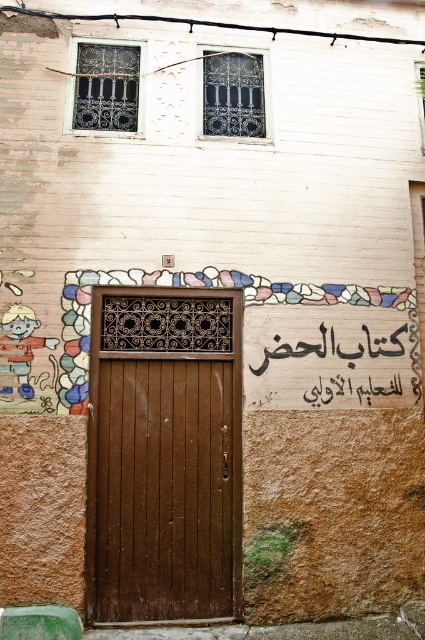
You are standing in front of a building and see the brown wooden door at center. A point marked at coordinates (164, 456) is labeled. Based on the scene, where is this point located?

The point at (164, 456) marks the brown wooden door at center.

You are a painter who needs to cover the entire surface of the brown wooden door at center and the wooden sign at center. Given that you have enough paint for a total area of 2 square meters, can you determine if both objects can be painted with the available paint?

The brown wooden door at center is narrower than the wooden sign at center. However, without knowing their exact dimensions or heights, it is impossible to calculate the total area. Therefore, it is uncertain if the available paint will suffice for both.